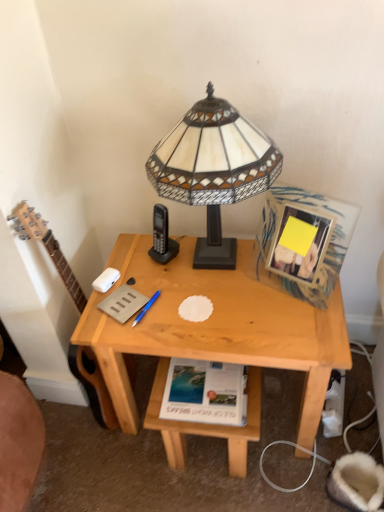
You are a GUI agent. You are given a task and a screenshot of the screen. Output one action in this format:
    pyautogui.click(x=<x>, y=<y>)
    Task: Click on the free point above natural wood table at lower center (from a real-world perspective)
    
    Given the screenshot: What is the action you would take?
    pyautogui.click(x=213, y=391)